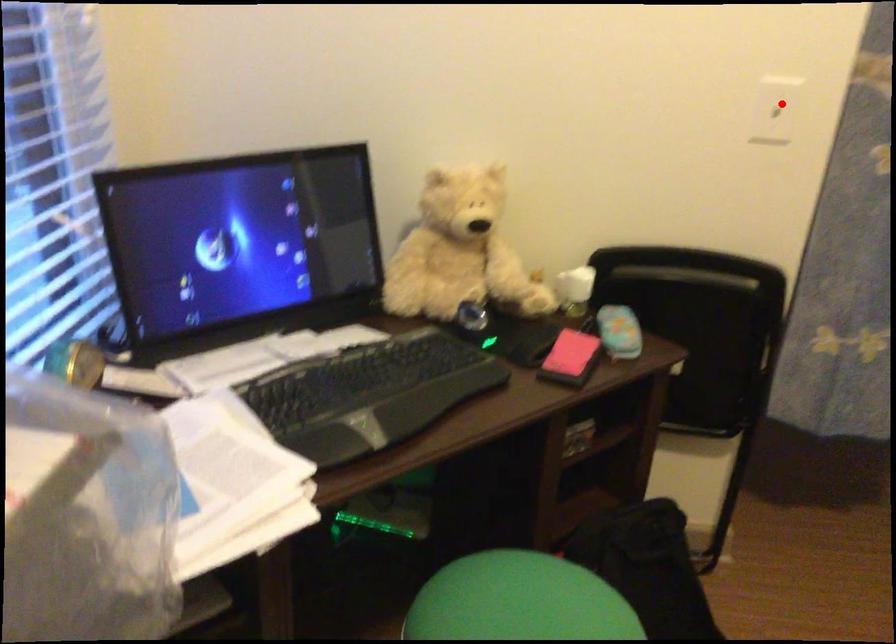
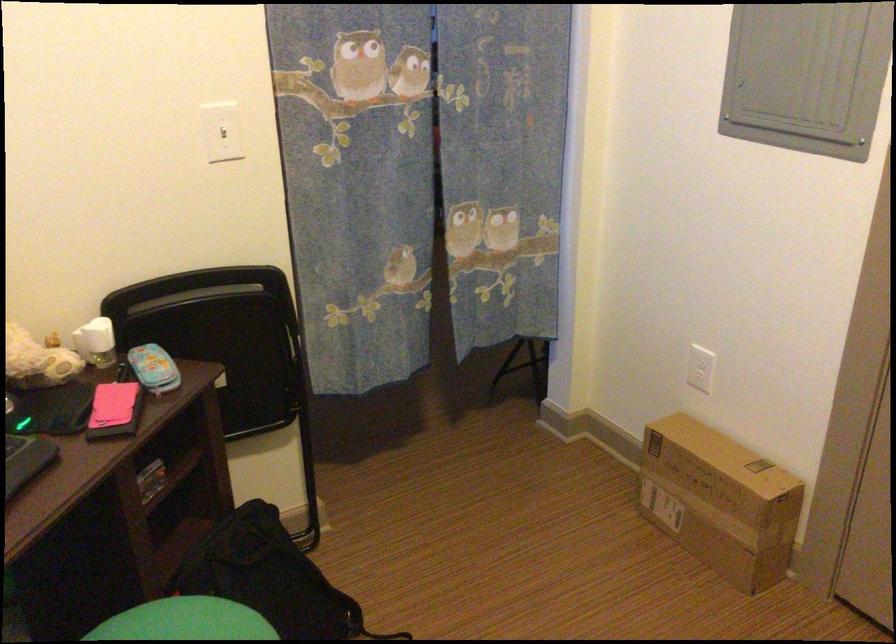
Question: I am providing you with two images of the same scene from different viewpoints. Image1 has a red point marked. In image2, the corresponding 3D location appears at what relative position? Reply with the corresponding letter.

Choices:
 (A) Closer
 (B) Farther

Answer: (B)